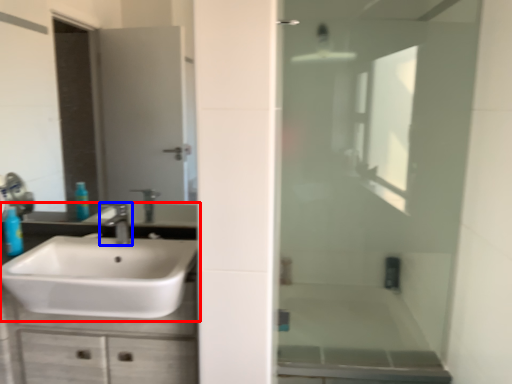
Question: Among these objects, which one is nearest to the camera, sink (highlighted by a red box) or tap (highlighted by a blue box)?

Choices:
 (A) sink
 (B) tap

Answer: (A)